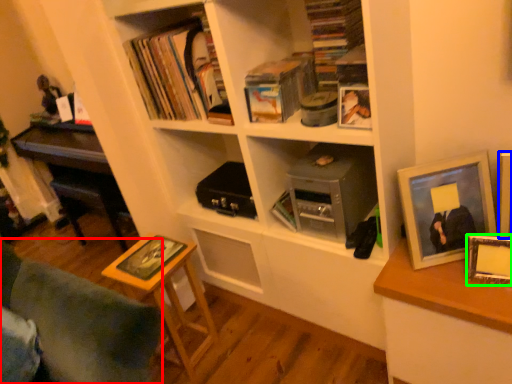
Question: Which object is positioned farthest from furniture (highlighted by a red box)? Select from picture frame (highlighted by a blue box) and picture frame (highlighted by a green box).

Choices:
 (A) picture frame
 (B) picture frame

Answer: (A)